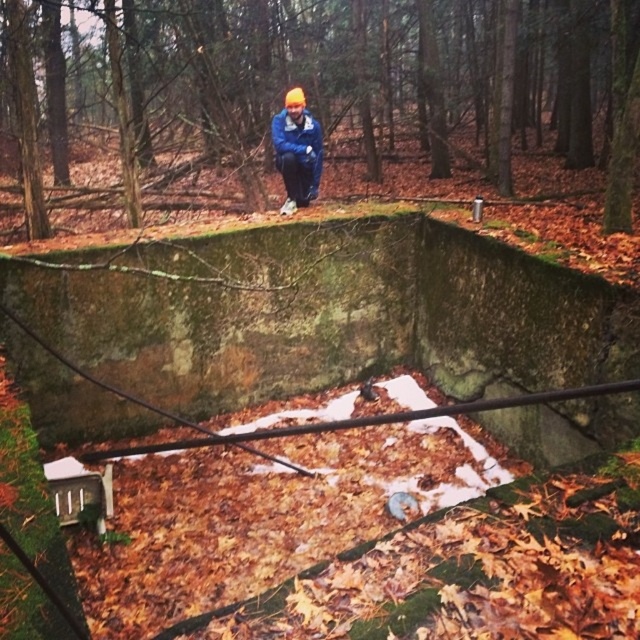
Question: Among these objects, which one is nearest to the camera?

Choices:
 (A) blue fleece jacket at center
 (B) green mossy stone at center

Answer: (B)

Question: Can you confirm if green mossy stone at center is positioned to the left of blue fleece jacket at center?

Choices:
 (A) yes
 (B) no

Answer: (B)

Question: Which object appears farthest from the camera in this image?

Choices:
 (A) blue fleece jacket at center
 (B) green mossy stone at center

Answer: (A)

Question: Among these objects, which one is farthest from the camera?

Choices:
 (A) green mossy stone at center
 (B) blue fleece jacket at center

Answer: (B)

Question: Does green mossy stone at center have a larger size compared to blue fleece jacket at center?

Choices:
 (A) yes
 (B) no

Answer: (A)

Question: Does green mossy stone at center have a smaller size compared to blue fleece jacket at center?

Choices:
 (A) yes
 (B) no

Answer: (B)